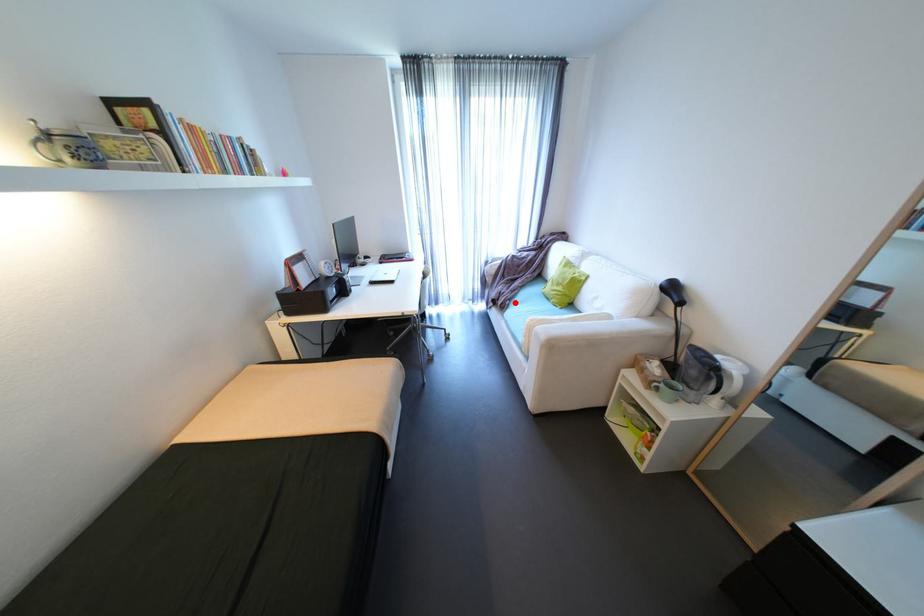
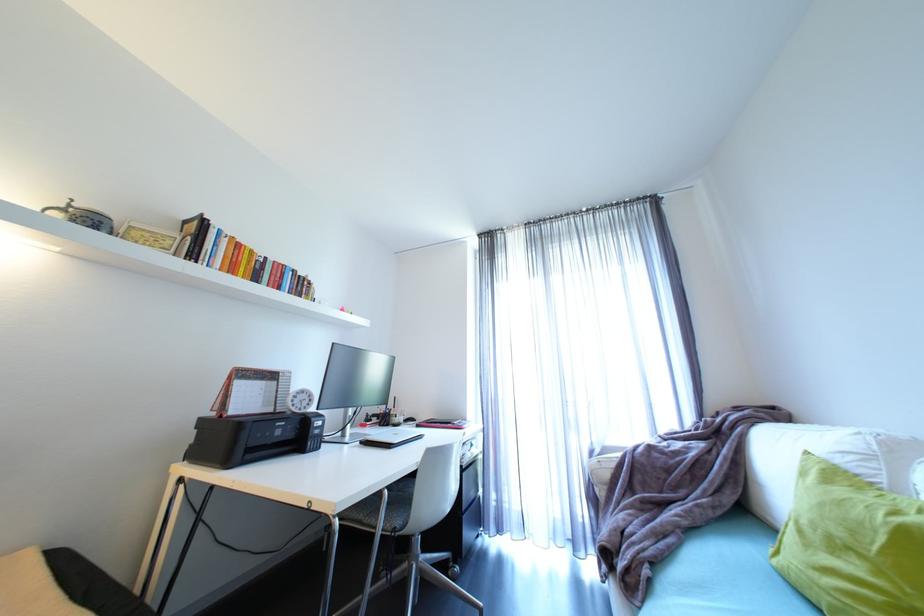
In the second image, find the point that corresponds to the highlighted location in the first image.

(653, 572)